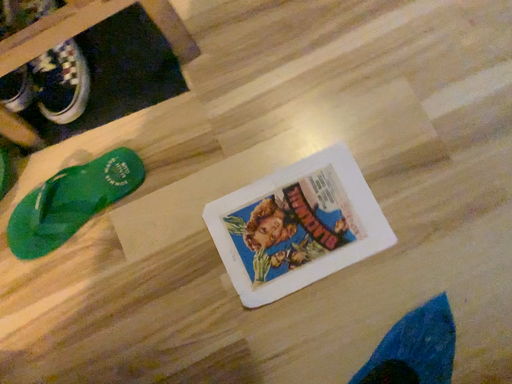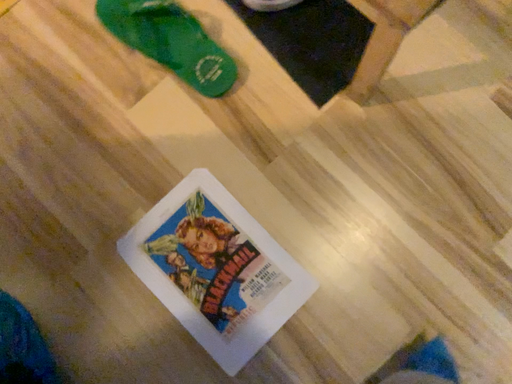
Question: Which way did the camera rotate in the video?

Choices:
 (A) rotated left
 (B) rotated right

Answer: (A)